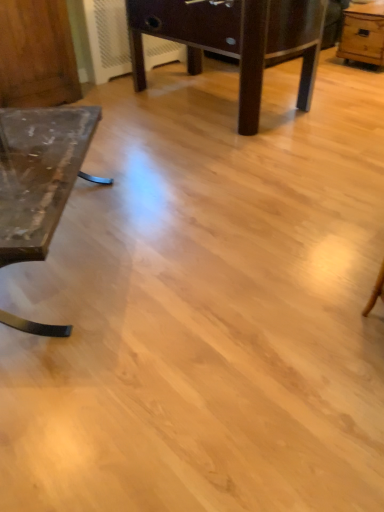
Question: From a real-world perspective, is dark brown wooden table at center, marked as the second table in a right-to-left arrangement, physically above light brown wooden table at upper right, placed as the third table when sorted from left to right?

Choices:
 (A) yes
 (B) no

Answer: (A)

Question: From the image's perspective, is dark brown wooden table at center, the 2th table viewed from the left, below light brown wooden table at upper right, arranged as the first table when viewed from the right?

Choices:
 (A) no
 (B) yes

Answer: (B)

Question: Is dark brown wooden table at center, marked as the second table in a right-to-left arrangement, outside of light brown wooden table at upper right, arranged as the first table when viewed from the right?

Choices:
 (A) no
 (B) yes

Answer: (B)

Question: Does dark brown wooden table at center, marked as the second table in a right-to-left arrangement, lie behind light brown wooden table at upper right, arranged as the first table when viewed from the right?

Choices:
 (A) no
 (B) yes

Answer: (A)

Question: Considering the relative positions of dark brown wooden table at center, the 2th table viewed from the left, and light brown wooden table at upper right, placed as the third table when sorted from left to right, in the image provided, is dark brown wooden table at center, the 2th table viewed from the left, to the right of light brown wooden table at upper right, placed as the third table when sorted from left to right, from the viewer's perspective?

Choices:
 (A) no
 (B) yes

Answer: (A)

Question: Is light brown wooden table at upper right, placed as the third table when sorted from left to right, in front of or behind dark brown wooden table at center, the 2th table viewed from the left, in the image?

Choices:
 (A) behind
 (B) front

Answer: (A)

Question: Looking at their shapes, would you say light brown wooden table at upper right, arranged as the first table when viewed from the right, is wider or thinner than dark brown wooden table at center, the 2th table viewed from the left?

Choices:
 (A) thin
 (B) wide

Answer: (A)

Question: Choose the correct answer: Is light brown wooden table at upper right, arranged as the first table when viewed from the right, inside dark brown wooden table at center, the 2th table viewed from the left, or outside it?

Choices:
 (A) inside
 (B) outside

Answer: (B)

Question: Considering the positions of light brown wooden table at upper right, arranged as the first table when viewed from the right, and dark brown wooden table at center, the 2th table viewed from the left, in the image, is light brown wooden table at upper right, arranged as the first table when viewed from the right, bigger or smaller than dark brown wooden table at center, the 2th table viewed from the left,?

Choices:
 (A) small
 (B) big

Answer: (A)

Question: From a real-world perspective, relative to dark brown wooden table at center, the 2th table viewed from the left, is wooden dresser at left vertically above or below?

Choices:
 (A) below
 (B) above

Answer: (A)

Question: In terms of size, does wooden dresser at left appear bigger or smaller than dark brown wooden table at center, marked as the second table in a right-to-left arrangement?

Choices:
 (A) small
 (B) big

Answer: (A)

Question: Do you think wooden dresser at left is within dark brown wooden table at center, the 2th table viewed from the left, or outside of it?

Choices:
 (A) outside
 (B) inside

Answer: (A)

Question: In terms of width, does wooden dresser at left look wider or thinner when compared to dark brown wooden table at center, marked as the second table in a right-to-left arrangement?

Choices:
 (A) wide
 (B) thin

Answer: (B)

Question: From a real-world perspective, relative to matte glass table at left, acting as the first table starting from the left, is wooden dresser at left vertically above or below?

Choices:
 (A) below
 (B) above

Answer: (B)

Question: Which is correct: wooden dresser at left is inside matte glass table at left, placed as the third table when sorted from right to left, or outside of it?

Choices:
 (A) outside
 (B) inside

Answer: (A)